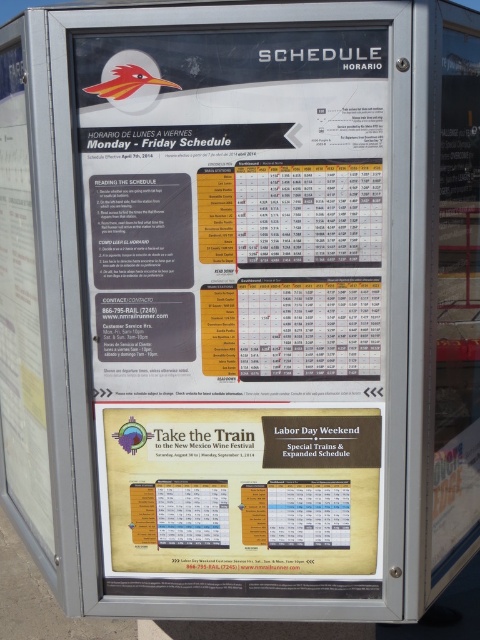
Between point (176, 360) and point (191, 513), which one is positioned in front?

Positioned in front is point (176, 360).

Who is shorter, white paper schedule at center or yellow paper-like labor day weekend poster at center?

yellow paper-like labor day weekend poster at center

Is point (355, 148) closer to viewer compared to point (213, 493)?

Yes, it is.

Where is `white paper schedule at center`? The width and height of the screenshot is (480, 640). white paper schedule at center is located at coordinates (237, 298).